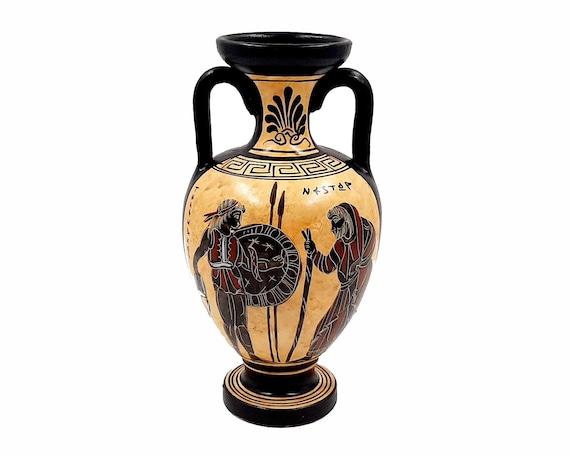
At what (x,y) coordinates should I click in order to perform the action: click on base of vase. Please return your answer as a coordinate pair (x, y). Looking at the image, I should click on (292, 422).